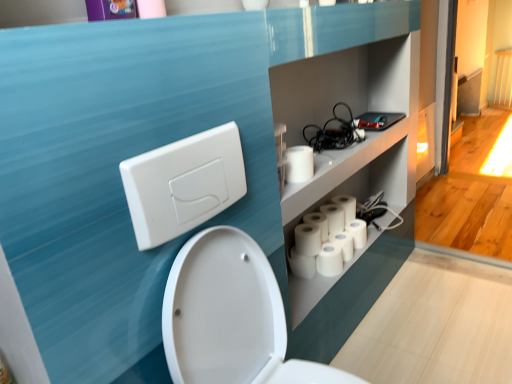
Question: From the image's perspective, does purple glossy picture frame at upper left appear lower than white matte toilet paper at lower center, which appears as the 2th toilet paper when viewed from the front?

Choices:
 (A) yes
 (B) no

Answer: (B)

Question: From the image's perspective, is purple glossy picture frame at upper left on top of white matte toilet paper at lower center, the 5th toilet paper viewed from the back?

Choices:
 (A) no
 (B) yes

Answer: (B)

Question: Is purple glossy picture frame at upper left oriented towards white matte toilet paper at lower center, which appears as the 2th toilet paper when viewed from the front?

Choices:
 (A) no
 (B) yes

Answer: (A)

Question: Considering the relative sizes of purple glossy picture frame at upper left and white matte toilet paper at lower center, the 5th toilet paper viewed from the back, in the image provided, is purple glossy picture frame at upper left shorter than white matte toilet paper at lower center, the 5th toilet paper viewed from the back,?

Choices:
 (A) no
 (B) yes

Answer: (A)

Question: Is purple glossy picture frame at upper left facing away from white matte toilet paper at lower center, which appears as the 2th toilet paper when viewed from the front?

Choices:
 (A) no
 (B) yes

Answer: (A)

Question: From a real-world perspective, is black rubber cables at upper right positioned above or below white matte toilet paper at lower center, the 5th toilet paper positioned from the front?

Choices:
 (A) above
 (B) below

Answer: (A)

Question: Is black rubber cables at upper right to the left or to the right of white matte toilet paper at lower center, the 5th toilet paper positioned from the front, in the image?

Choices:
 (A) left
 (B) right

Answer: (A)

Question: Is black rubber cables at upper right spatially inside white matte toilet paper at lower center, the 5th toilet paper positioned from the front, or outside of it?

Choices:
 (A) inside
 (B) outside

Answer: (B)

Question: Is point (344, 120) closer or farther from the camera than point (355, 243)?

Choices:
 (A) closer
 (B) farther

Answer: (B)

Question: Looking at the image, does white glossy toilet at center seem bigger or smaller compared to white plastic/light switch at upper left?

Choices:
 (A) big
 (B) small

Answer: (A)

Question: Which is correct: white glossy toilet at center is inside white plastic/light switch at upper left, or outside of it?

Choices:
 (A) inside
 (B) outside

Answer: (B)

Question: Considering the positions of point (253, 261) and point (200, 178), is point (253, 261) closer or farther from the camera than point (200, 178)?

Choices:
 (A) farther
 (B) closer

Answer: (A)

Question: Is white glossy toilet at center in front of or behind white plastic/light switch at upper left in the image?

Choices:
 (A) behind
 (B) front

Answer: (B)

Question: From the image's perspective, is white matte toilet paper at upper right, the sixth toilet paper positioned from the back, positioned above or below white matte toilet paper at lower center, the 5th toilet paper viewed from the back?

Choices:
 (A) above
 (B) below

Answer: (A)

Question: Is point (307, 162) closer or farther from the camera than point (306, 243)?

Choices:
 (A) closer
 (B) farther

Answer: (A)